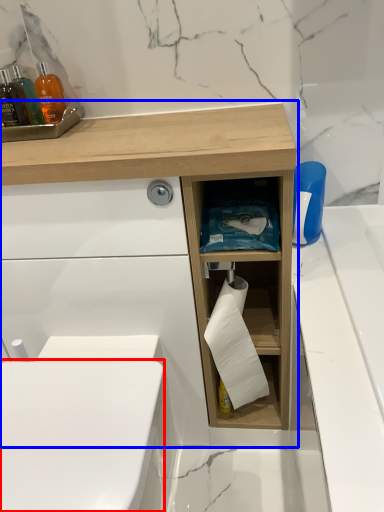
Question: Which of the following is the closest to the observer, toilet bowl (highlighted by a red box) or bathroom cabinet (highlighted by a blue box)?

Choices:
 (A) toilet bowl
 (B) bathroom cabinet

Answer: (A)